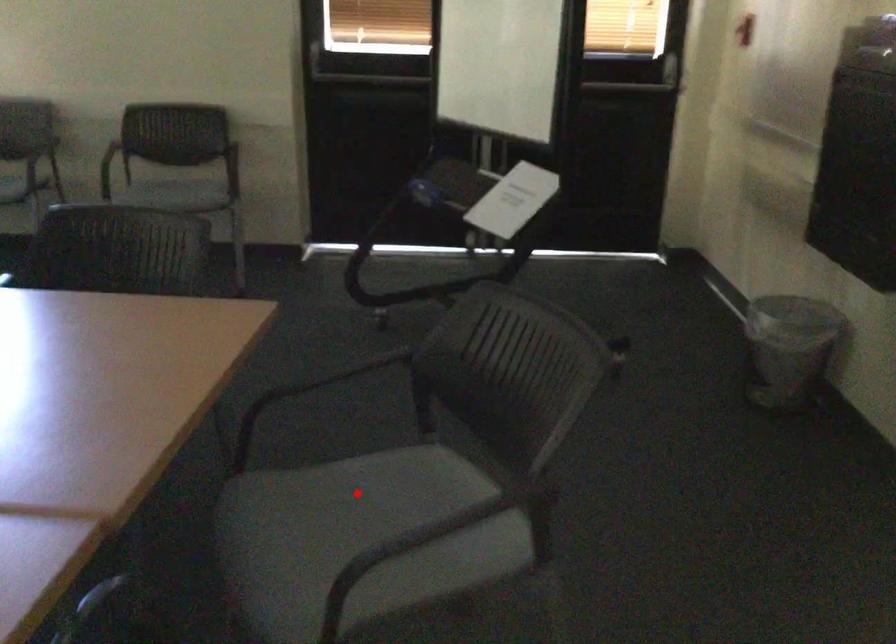
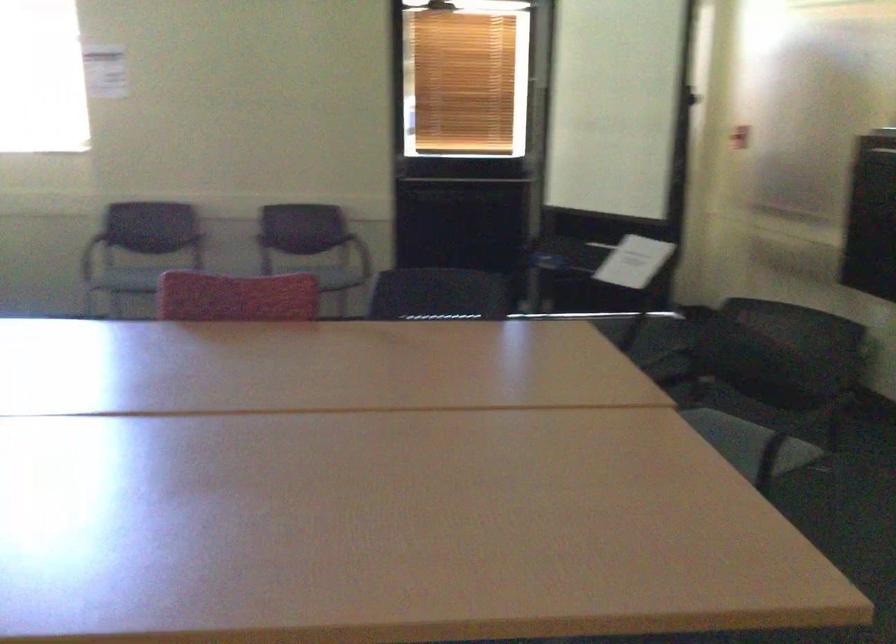
Question: I am providing you with two images of the same scene from different viewpoints. A red point is marked on the first image. Is the red point's position out of view in image 2?

Choices:
 (A) Yes
 (B) No

Answer: (A)